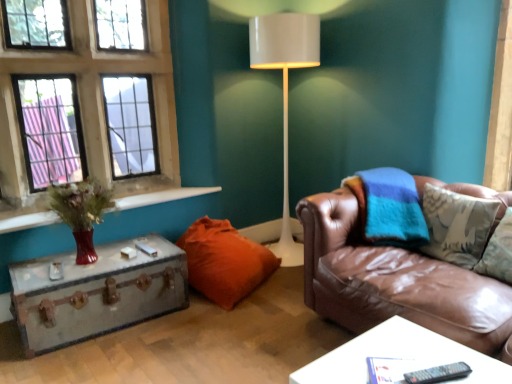
You are a GUI agent. You are given a task and a screenshot of the screen. Output one action in this format:
    pyautogui.click(x=<x>, y=<y>)
    Task: Click on the vacant area that is in front of metallic suitcase at left, the 1th table from the left
    
    Given the screenshot: What is the action you would take?
    pyautogui.click(x=94, y=360)